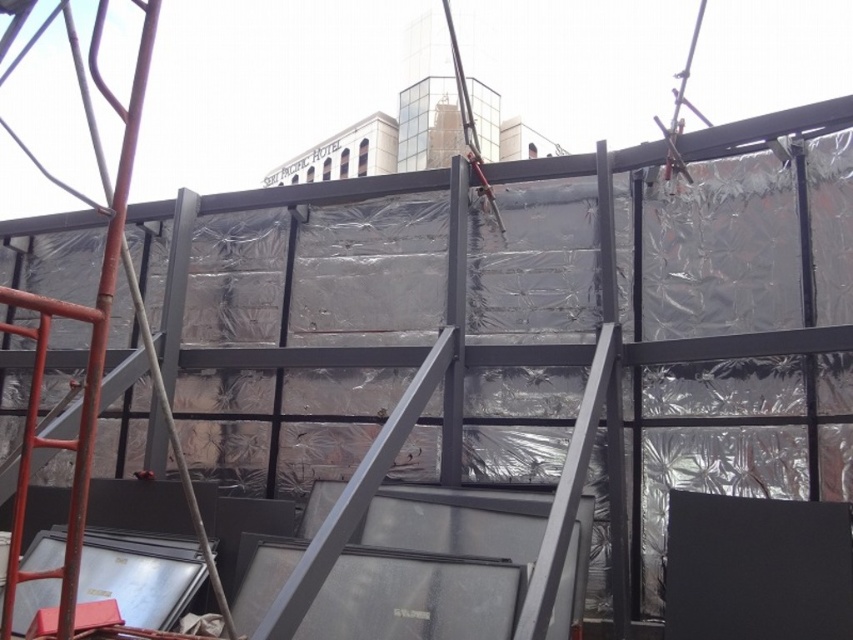
You are a construction worker who needs to reach the top of the metal framework to secure more plastic sheeting. You see the red metal ladder at left and the metal at center. Which object should you use to climb safely?

You should use the red metal ladder at left to climb safely because it is a ladder designed for climbing, while the metal at center is part of the building framework and not meant for climbing.

Based on the photo, you are a construction worker who needs to reach the top of the structure. You have a red metal ladder at left and a metal at center. Which one can you use to reach higher?

The red metal ladder at left is taller than the metal at center, so you can use the red metal ladder at left to reach higher.